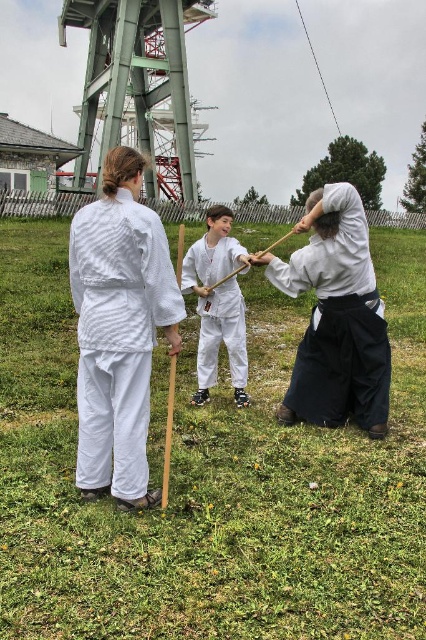
Question: Which of the following is the farthest from the observer?

Choices:
 (A) (141, 208)
 (B) (230, 330)
 (C) (325, 384)

Answer: (B)

Question: Is white woven kimono at center to the right of white matte uniform at center from the viewer's perspective?

Choices:
 (A) yes
 (B) no

Answer: (B)

Question: Among these points, which one is nearest to the camera?

Choices:
 (A) (215, 337)
 (B) (112, 410)

Answer: (B)

Question: Which object appears farthest from the camera in this image?

Choices:
 (A) white matte uniform at center
 (B) white cotton kimono at center

Answer: (A)

Question: Considering the relative positions of white cotton kimono at center and white matte uniform at center in the image provided, where is white cotton kimono at center located with respect to white matte uniform at center?

Choices:
 (A) below
 (B) above

Answer: (A)

Question: In this image, where is white woven kimono at center located relative to white matte uniform at center?

Choices:
 (A) above
 (B) below

Answer: (B)